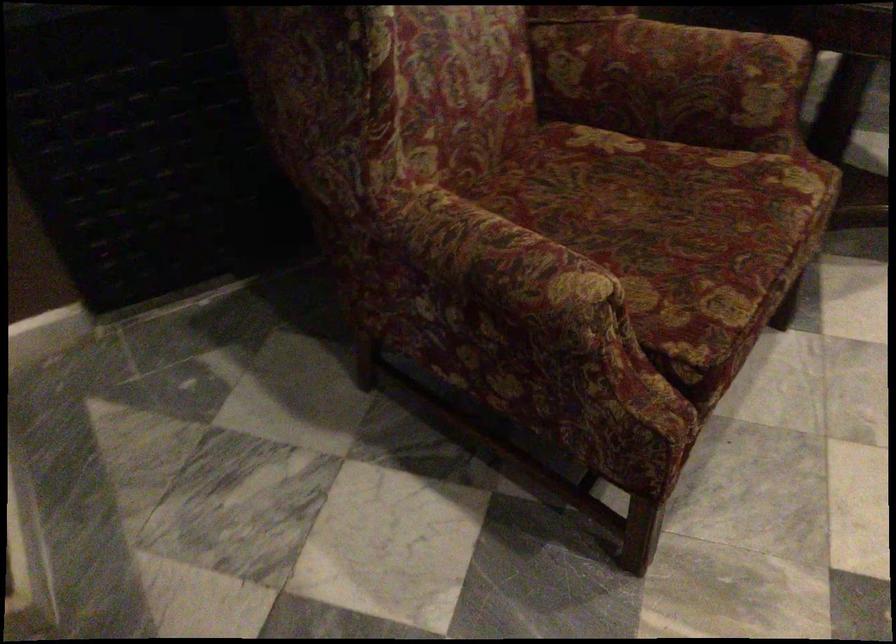
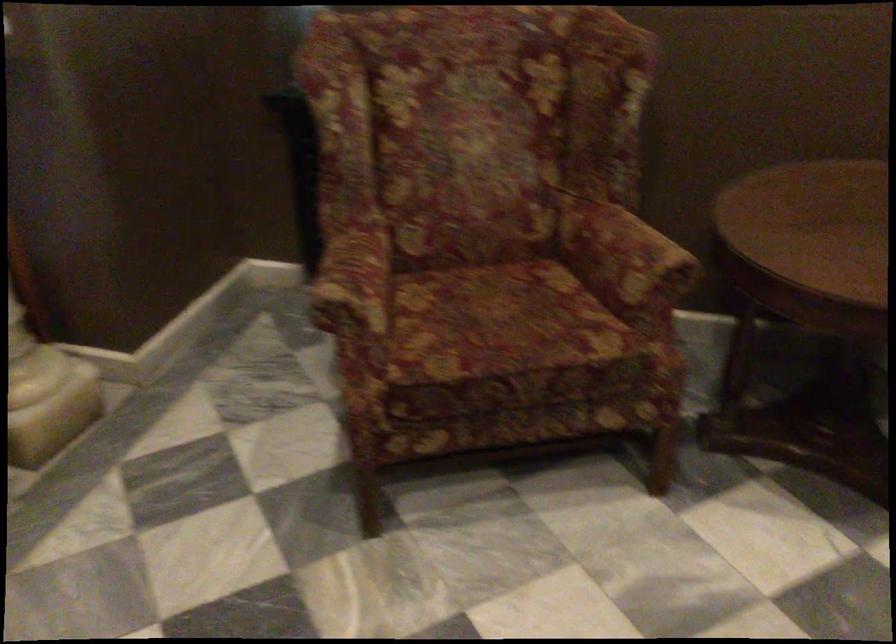
Find the pixel in the second image that matches (x=668, y=223) in the first image.

(501, 323)